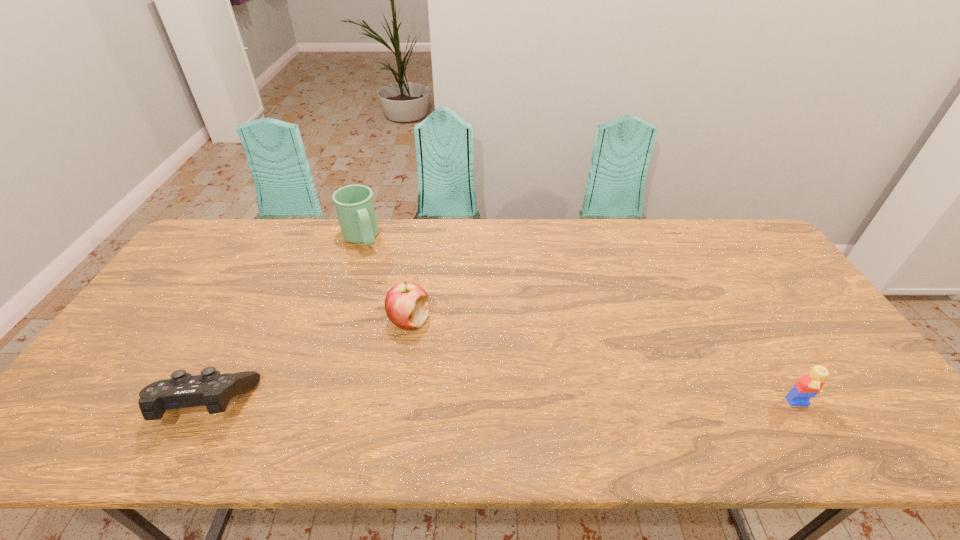
You are a GUI agent. You are given a task and a screenshot of the screen. Output one action in this format:
    pyautogui.click(x=<x>, y=<y>)
    Task: Click on the empty space that is in between the rightmost object and the shortest object
    The height and width of the screenshot is (540, 960).
    Given the screenshot: What is the action you would take?
    pyautogui.click(x=502, y=405)

Image resolution: width=960 pixels, height=540 pixels. Find the location of `free spot between the Lego and the control`. free spot between the Lego and the control is located at coordinates (502, 405).

What are the coordinates of `vacant space in between the third object from left to right and the rightmost object` in the screenshot? It's located at (604, 363).

Locate which object ranks third in proximity to the third object from right to left. Please provide its 2D coordinates. Your answer should be formatted as a tuple, i.e. [(x, y)], where the tuple contains the x and y coordinates of a point satisfying the conditions above.

[(809, 385)]

Locate an element on the screen. object that is the second nearest to the apple is located at coordinates (211, 389).

I want to click on blank space that satisfies the following two spatial constraints: 1. on the front side of the second object from left to right; 2. on the right side of the apple, so click(x=333, y=321).